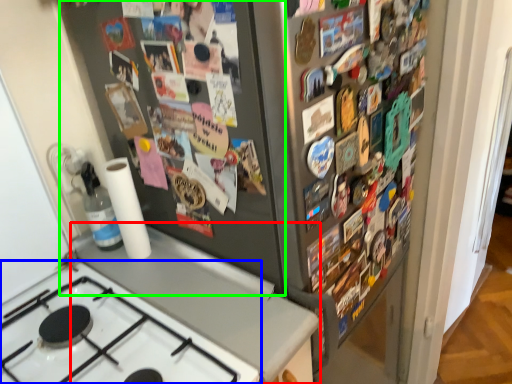
Question: Which object is positioned closest to counter top (highlighted by a red box)? Select from gas stove (highlighted by a blue box) and bulletin board (highlighted by a green box).

Choices:
 (A) gas stove
 (B) bulletin board

Answer: (A)